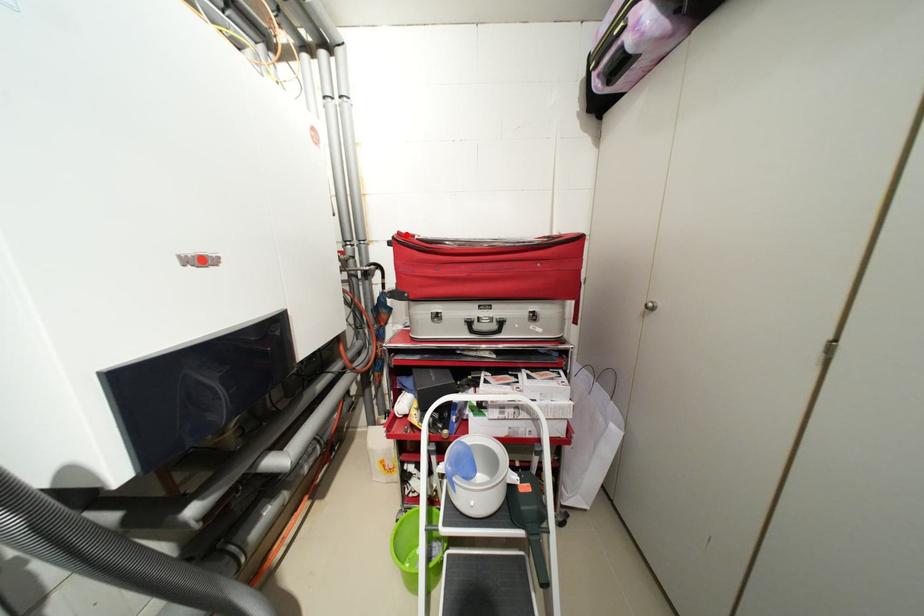
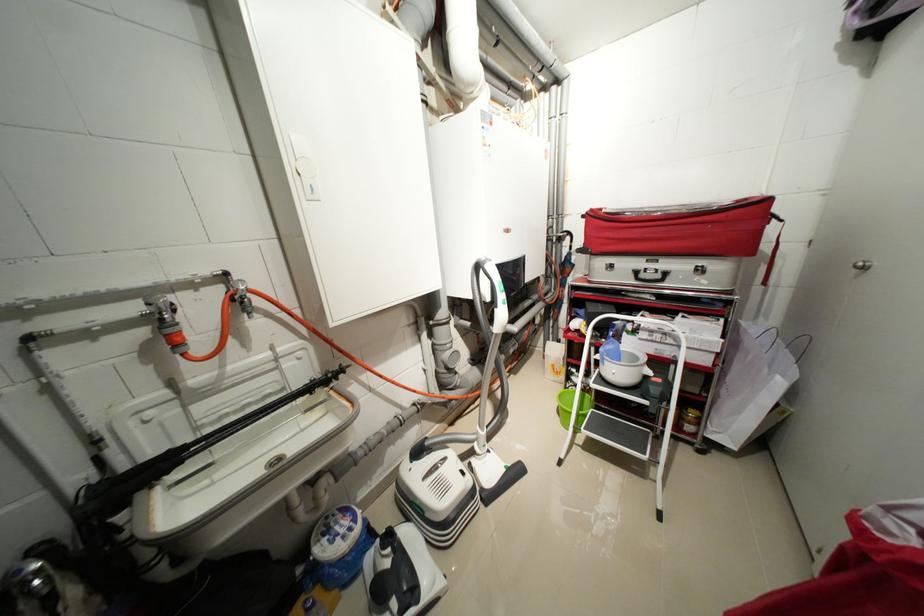
Question: A red point is marked in image1. In image2, is the corresponding 3D point closer to the camera or farther? Reply with the corresponding letter.

Choices:
 (A) The corresponding 3D point is closer.
 (B) The corresponding 3D point is farther.

Answer: (A)